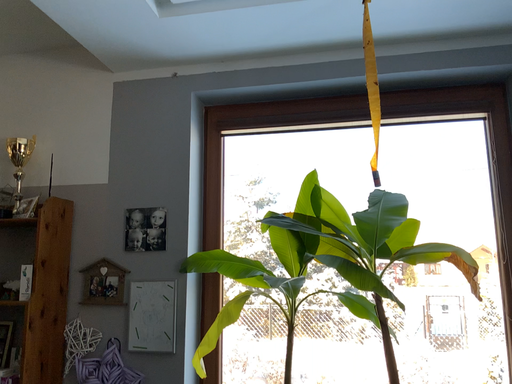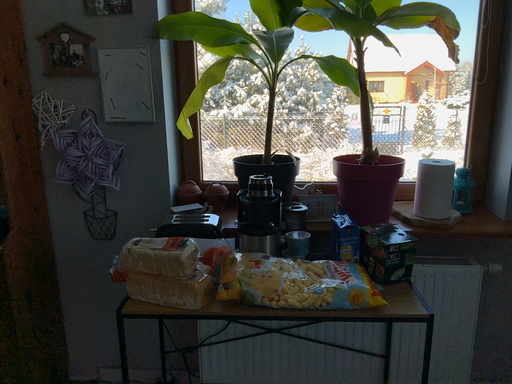
Question: Which way did the camera rotate in the video?

Choices:
 (A) rotated downward
 (B) rotated upward

Answer: (A)